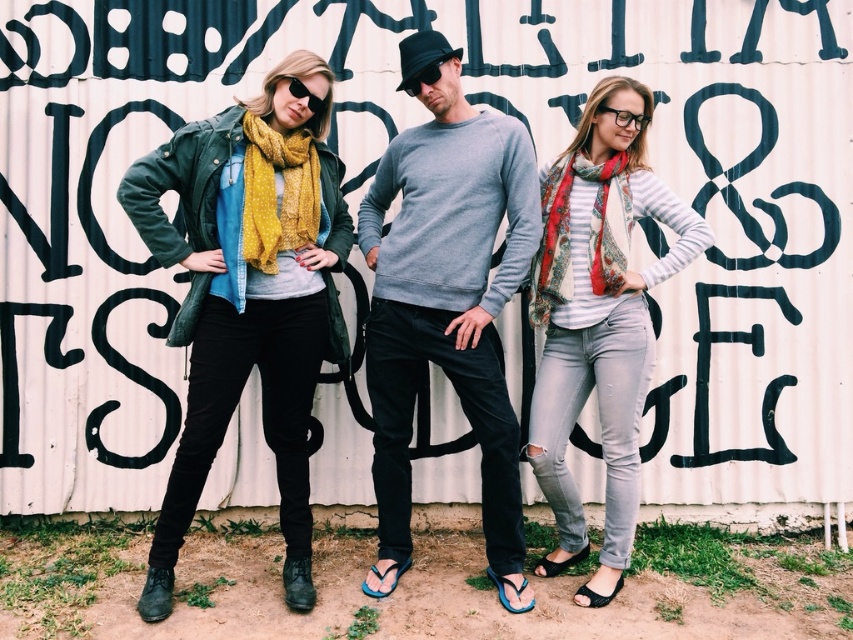
Question: Does gray cotton sweater at center lie behind yellow dotted scarf at left?

Choices:
 (A) yes
 (B) no

Answer: (A)

Question: Does yellow dotted scarf at left have a smaller size compared to black matte sunglasses at center?

Choices:
 (A) no
 (B) yes

Answer: (A)

Question: Which object is the closest to the yellow dotted scarf at left?

Choices:
 (A) matte green jacket at left
 (B) black matte sunglasses at upper center
 (C) black matte sunglasses at center
 (D) clear plastic glasses at center

Answer: (A)

Question: Does gray cotton sweater at center appear on the left side of clear plastic glasses at center?

Choices:
 (A) yes
 (B) no

Answer: (A)

Question: Estimate the real-world distances between objects in this image. Which object is farther from the matte green jacket at left?

Choices:
 (A) striped cotton shirt at center
 (B) yellow dotted scarf at left
 (C) gray cotton sweater at center
 (D) black matte sunglasses at center

Answer: (A)

Question: Estimate the real-world distances between objects in this image. Which object is closer to the black matte sunglasses at upper center?

Choices:
 (A) yellow dotted scarf at left
 (B) striped cotton shirt at center

Answer: (A)